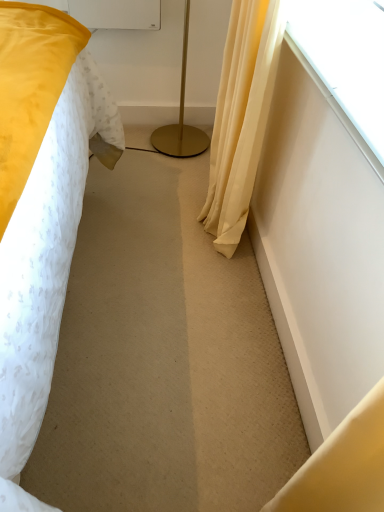
Find the location of a particular element. The image size is (384, 512). free space in front of gold metallic floor lamp at center is located at coordinates click(x=162, y=175).